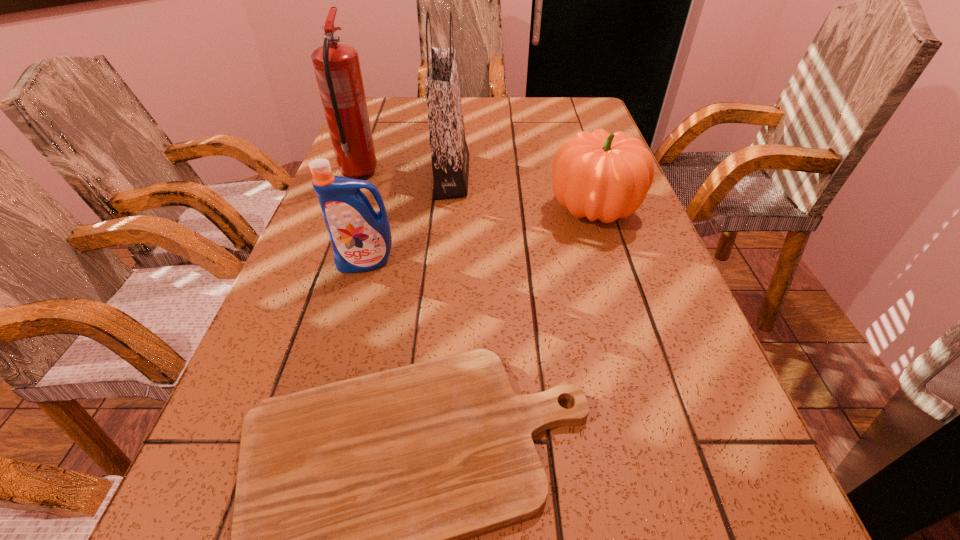
Identify the location of empty location between the fourth tallest object and the fire extinguisher. The image size is (960, 540). (476, 191).

Identify the location of the closest object relative to the pumpkin. This screenshot has width=960, height=540. (449, 152).

Locate which object ranks in proximity to the fire extinguisher. Please provide its 2D coordinates. Your answer should be formatted as a tuple, i.e. [(x, y)], where the tuple contains the x and y coordinates of a point satisfying the conditions above.

[(449, 152)]

Where is `vacant region that satisfies the following two spatial constraints: 1. on the front of the fourth tallest object with the design; 2. on the right side of the shopping bag`? The image size is (960, 540). vacant region that satisfies the following two spatial constraints: 1. on the front of the fourth tallest object with the design; 2. on the right side of the shopping bag is located at coordinates (448, 210).

Locate an element on the screen. The width and height of the screenshot is (960, 540). vacant space that satisfies the following two spatial constraints: 1. on the front of the shopping bag with the design; 2. on the label of the detergent is located at coordinates (x=444, y=262).